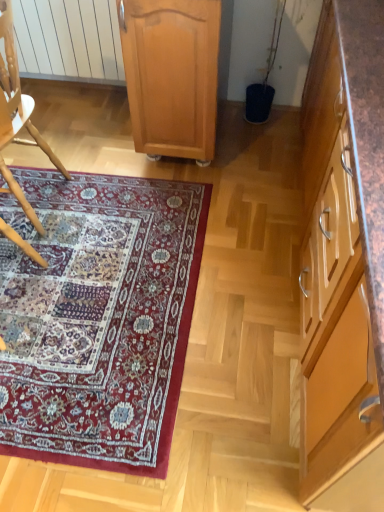
Locate an element on the screen. The width and height of the screenshot is (384, 512). vacant space underneath wooden chair at left (from a real-world perspective) is located at coordinates (33, 195).